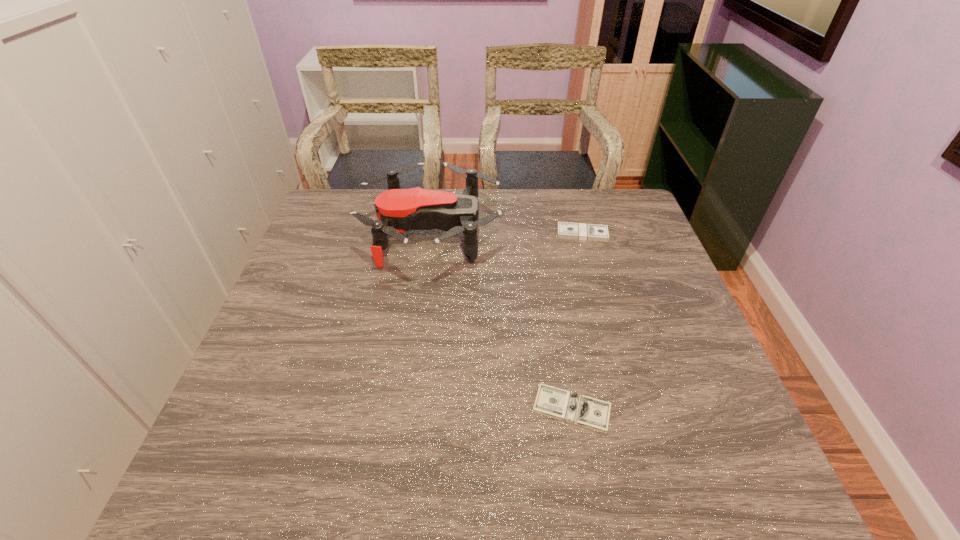
Identify the location of vacant space that satisfies the following two spatial constraints: 1. on the camera side of the shortest object; 2. on the right side of the drone. (409, 409).

At what (x,y) coordinates should I click in order to perform the action: click on blank space that satisfies the following two spatial constraints: 1. on the back side of the taller dollar; 2. on the camera side of the tallest object. Please return your answer as a coordinate pair (x, y). The image size is (960, 540). Looking at the image, I should click on (582, 231).

In order to click on free space in the image that satisfies the following two spatial constraints: 1. on the back side of the shorter dollar; 2. on the left side of the taller dollar in this screenshot , I will do `click(542, 234)`.

The height and width of the screenshot is (540, 960). I want to click on vacant region that satisfies the following two spatial constraints: 1. on the camera side of the leftmost object; 2. on the back side of the nearer dollar, so click(x=409, y=409).

Identify the location of free spot that satisfies the following two spatial constraints: 1. on the back side of the shorter dollar; 2. on the camera side of the leftmost object. (541, 231).